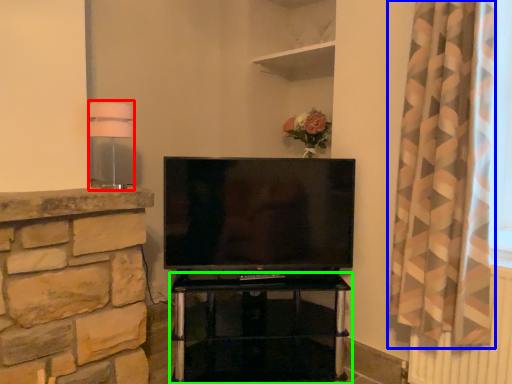
Question: Which is nearer to the lamp (highlighted by a red box)? curtain (highlighted by a blue box) or furniture (highlighted by a green box).

Choices:
 (A) curtain
 (B) furniture

Answer: (A)